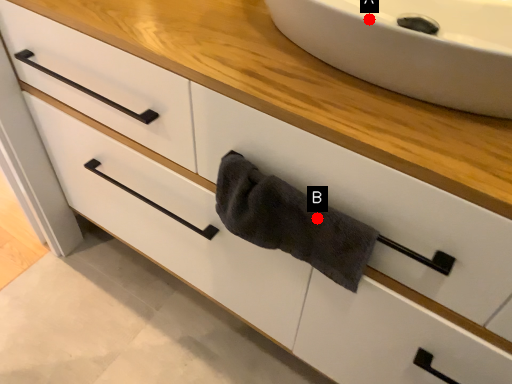
Question: Two points are circled on the image, labeled by A and B beside each circle. Which point is closer to the camera?

Choices:
 (A) A is closer
 (B) B is closer

Answer: (A)